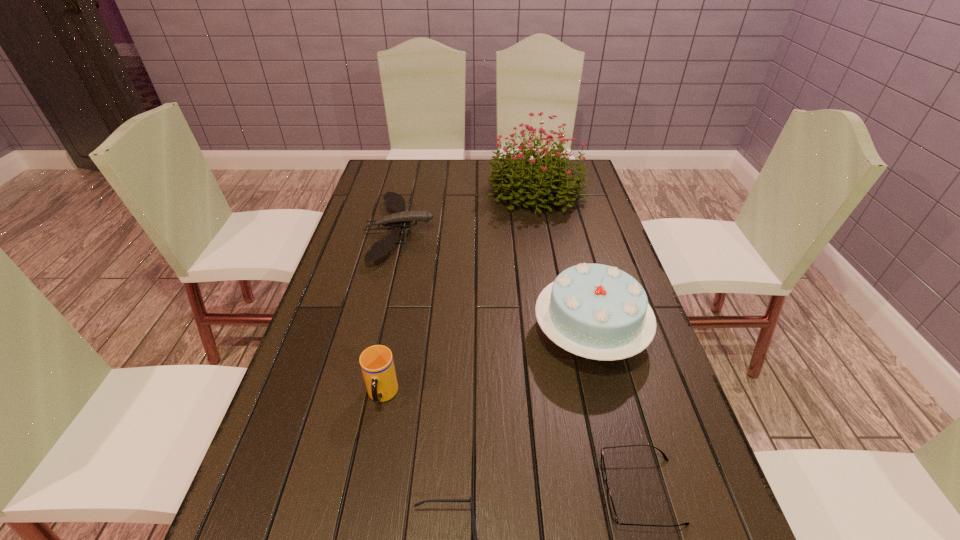
Find the location of `vacant space at the left edge`. vacant space at the left edge is located at coordinates (329, 494).

Locate an element on the screen. This screenshot has height=540, width=960. free space at the right edge of the desktop is located at coordinates (620, 249).

Where is `vacant space at the far left corner of the desktop`? vacant space at the far left corner of the desktop is located at coordinates (385, 183).

This screenshot has width=960, height=540. What are the coordinates of `free space between the bouquet and the drone` in the screenshot? It's located at (468, 212).

The image size is (960, 540). In order to click on vacant space that's between the fifth shortest object and the shorter spectacles in this screenshot , I will do `click(615, 412)`.

Locate an element on the screen. vacant area between the drone and the birthday cake is located at coordinates (494, 282).

This screenshot has width=960, height=540. I want to click on vacant point located between the drone and the second tallest object, so [x=494, y=282].

This screenshot has width=960, height=540. Identify the location of free spot between the third shortest object and the bouquet. (468, 212).

Locate an element on the screen. The width and height of the screenshot is (960, 540). empty location between the birthday cake and the cup is located at coordinates (486, 364).

The image size is (960, 540). I want to click on empty location between the cup and the fourth tallest object, so click(391, 313).